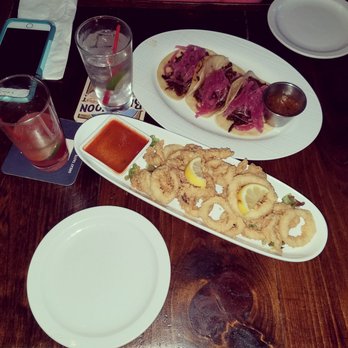
You are a GUI agent. You are given a task and a screenshot of the screen. Output one action in this format:
    pyautogui.click(x=<x>, y=<y>)
    Task: Click on the appetizer plates
    
    Given the screenshot: What is the action you would take?
    pyautogui.click(x=110, y=280), pyautogui.click(x=314, y=40)